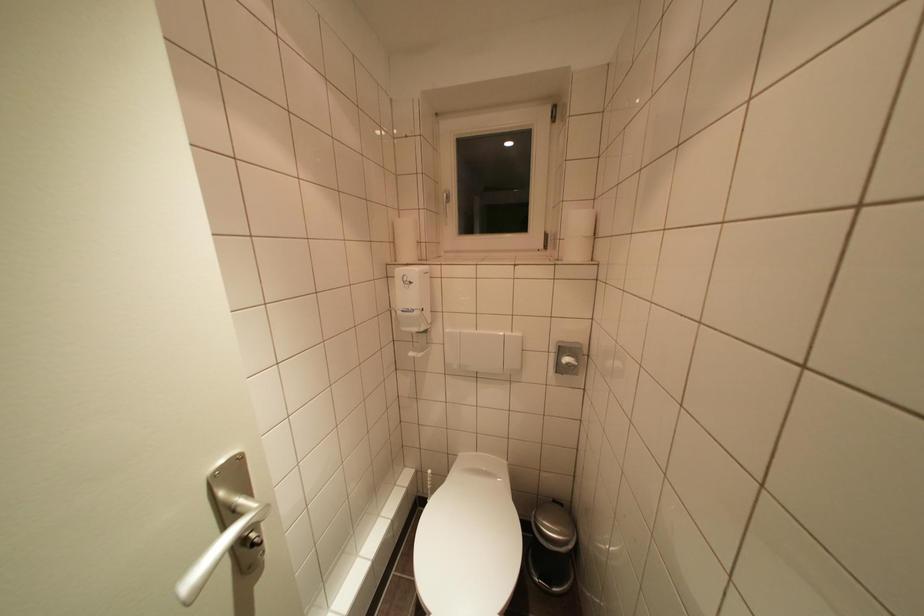
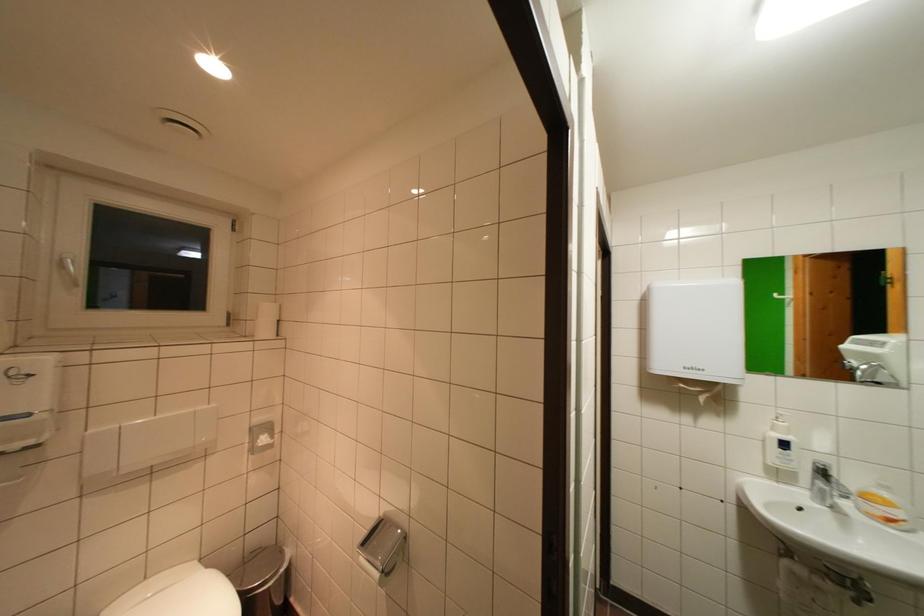
Question: Based on the continuous images, in which direction is the camera rotating? Reply with the corresponding letter.

Choices:
 (A) Left
 (B) Right
 (C) Up
 (D) Down

Answer: (B)